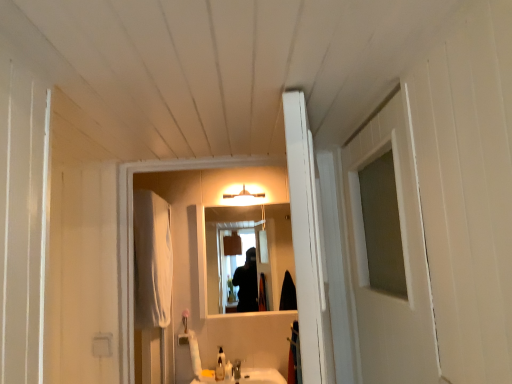
What are the coordinates of `satin nickel faucet at lower center` in the screenshot? It's located at (236, 370).

In order to face satin nickel faucet at lower center, should I rotate leftwards or rightwards?

Turn left approximately 1.863 degrees to face it.

Measure the distance between point (226,374) and camera.

Point (226,374) is 2.90 meters away from camera.

The height and width of the screenshot is (384, 512). What are the coordinates of `white fabric curtain at left` in the screenshot? It's located at (152, 260).

Considering the relative sizes of clear glass mirror at center and white wooden door at center in the image provided, is clear glass mirror at center shorter than white wooden door at center?

No.

Is white wooden door at center at the back of clear glass mirror at center?

No, white wooden door at center is not at the back of clear glass mirror at center.

Is white wooden door at center surrounded by clear glass mirror at center?

That's incorrect, white wooden door at center is not inside clear glass mirror at center.

From a real-world perspective, is clear glass mirror at center located beneath white wooden door at center?

No, from a real-world perspective, clear glass mirror at center is not beneath white wooden door at center.

Who is bigger, translucent plastic soap at center or matte white light fixture at upper center?

Bigger between the two is matte white light fixture at upper center.

From the image's perspective, relative to matte white light fixture at upper center, is translucent plastic soap at center above or below?

translucent plastic soap at center is situated lower than matte white light fixture at upper center in the image.

Looking at their sizes, would you say translucent plastic soap at center is wider or thinner than matte white light fixture at upper center?

Considering their sizes, translucent plastic soap at center looks slimmer than matte white light fixture at upper center.

At what (x,y) coordinates should I click in order to perform the action: click on faucet below the translucent glass bottle at lower center (from the image's perspective). Please return your answer as a coordinate pair (x, y). Looking at the image, I should click on (236, 370).

Is satin nickel faucet at lower center directly adjacent to translucent glass bottle at lower center?

Absolutely, satin nickel faucet at lower center is next to and touching translucent glass bottle at lower center.

Where is `mirror on the left of white wooden door at center`? The width and height of the screenshot is (512, 384). mirror on the left of white wooden door at center is located at coordinates (246, 254).

Which is farther, (311, 290) or (223, 245)?

Point (223, 245)

Consider the image. Can you tell me how much white wooden door at center and clear glass mirror at center differ in facing direction?

There is a 102-degree angle between the facing directions of white wooden door at center and clear glass mirror at center.

Consider the image. Is satin nickel faucet at lower center not within clear glass mirror at center?

Yes.

Is satin nickel faucet at lower center far from clear glass mirror at center?

Yes.

Which point is more forward, (x=239, y=361) or (x=240, y=260)?

Point (x=239, y=361)

Between satin nickel faucet at lower center and clear glass mirror at center, which one has more height?

Standing taller between the two is clear glass mirror at center.

From a real-world perspective, which object rests below the other?

white wooden door at center.

In the scene shown: Which is closer to the camera, (311, 334) or (134, 211)?

Clearly, point (311, 334) is closer to the camera than point (134, 211).

Where is `curtain on the left of white wooden door at center`? Image resolution: width=512 pixels, height=384 pixels. curtain on the left of white wooden door at center is located at coordinates click(152, 260).

Considering the sizes of objects white wooden door at center and white fabric curtain at left in the image provided, who is shorter, white wooden door at center or white fabric curtain at left?

white wooden door at center.

Considering the positions of points (234, 368) and (294, 252), is point (234, 368) farther from camera compared to point (294, 252)?

Yes, it is.

Does satin nickel faucet at lower center turn towards white wooden door at center?

Yes, satin nickel faucet at lower center is turned towards white wooden door at center.

Which object is wider, satin nickel faucet at lower center or white wooden door at center?

satin nickel faucet at lower center.

How far apart are satin nickel faucet at lower center and white wooden door at center?

satin nickel faucet at lower center and white wooden door at center are 2.29 meters apart from each other.

Where is `door in front of the clear glass mirror at center`? Image resolution: width=512 pixels, height=384 pixels. door in front of the clear glass mirror at center is located at coordinates (306, 240).

Image resolution: width=512 pixels, height=384 pixels. In order to click on toiletry below the matte white light fixture at upper center (from the image's perspective) in this screenshot , I will do `click(228, 370)`.

Estimate the real-world distances between objects in this image. Which object is closer to matte white light fixture at upper center, translucent plastic soap at center or translucent glass bottle at lower center?

Based on the image, translucent glass bottle at lower center appears to be nearer to matte white light fixture at upper center.

Looking at this image, estimate the real-world distances between objects in this image. Which object is closer to white fabric curtain at left, satin nickel faucet at lower center or translucent glass bottle at lower center?

The object closer to white fabric curtain at left is translucent glass bottle at lower center.

Considering their positions, is white fabric curtain at left positioned closer to satin nickel faucet at lower center than matte white light fixture at upper center?

white fabric curtain at left.

From the image, which object appears to be farther from clear glass mirror at center, white wooden door at center or white fabric curtain at left?

white wooden door at center.

When comparing their distances from matte white light fixture at upper center, does clear glass mirror at center or translucent plastic soap at center seem closer?

clear glass mirror at center is closer to matte white light fixture at upper center.

Considering their positions, is white fabric curtain at left positioned closer to translucent glass bottle at lower center than white wooden door at center?

white fabric curtain at left is positioned closer to the anchor translucent glass bottle at lower center.

Which object lies further to the anchor point clear glass mirror at center, translucent glass bottle at lower center or matte white light fixture at upper center?

translucent glass bottle at lower center lies further to clear glass mirror at center than the other object.

Considering their positions, is satin nickel faucet at lower center positioned closer to matte white light fixture at upper center than clear glass mirror at center?

The object closer to matte white light fixture at upper center is clear glass mirror at center.

Locate an element on the screen. faucet that lies between clear glass mirror at center and translucent plastic soap at center from top to bottom is located at coordinates (236, 370).

Where is `mirror between matte white light fixture at upper center and satin nickel faucet at lower center from top to bottom`? This screenshot has width=512, height=384. mirror between matte white light fixture at upper center and satin nickel faucet at lower center from top to bottom is located at coordinates (246, 254).

You are a GUI agent. You are given a task and a screenshot of the screen. Output one action in this format:
    pyautogui.click(x=<x>, y=<y>)
    Task: Click on the mirror between matte white light fixture at upper center and translucent glass bottle at lower center vertically
    
    Given the screenshot: What is the action you would take?
    pyautogui.click(x=246, y=254)

In order to click on toiletry located between white wooden door at center and translucent glass bottle at lower center in the depth direction in this screenshot , I will do `click(228, 370)`.